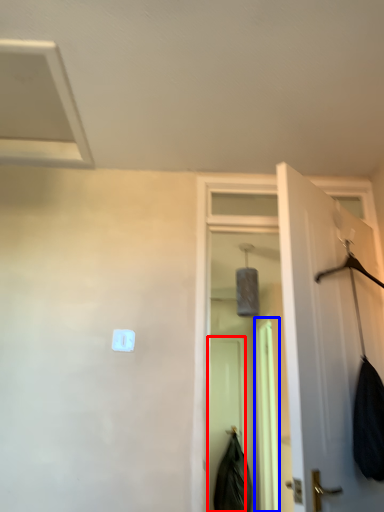
Question: Among these objects, which one is nearest to the camera, screen door (highlighted by a red box) or screen door (highlighted by a blue box)?

Choices:
 (A) screen door
 (B) screen door

Answer: (B)